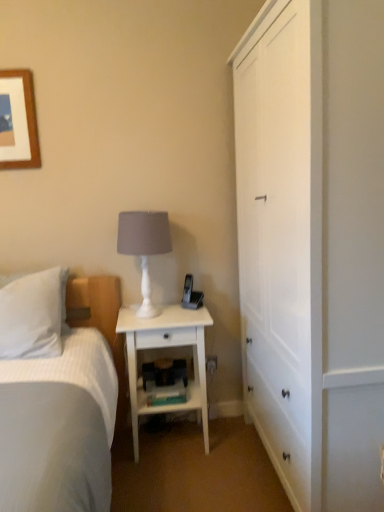
Image resolution: width=384 pixels, height=512 pixels. What are the coordinates of `empty space that is ontop of white wood nightstand at center (from a real-world perspective)` in the screenshot? It's located at (170, 311).